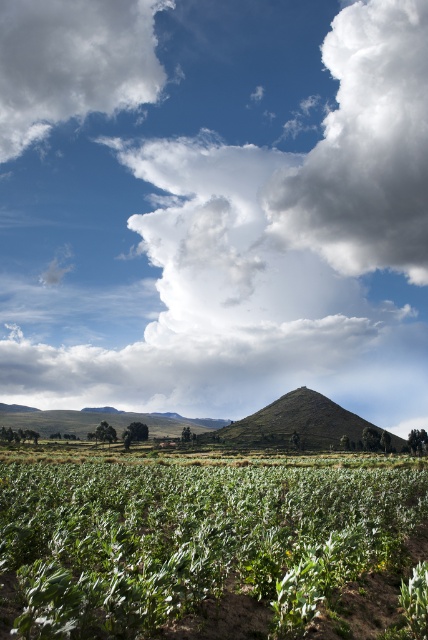
Looking at this image, which is above, white fluffy cloud at upper left or green grassy hill at center?

white fluffy cloud at upper left is higher up.

Consider the image. Who is more forward, (20, 81) or (299, 448)?

Point (299, 448)

Where is `white fluffy cloud at upper left`? This screenshot has width=428, height=640. white fluffy cloud at upper left is located at coordinates (74, 61).

Which is in front, point (92, 548) or point (403, 161)?

Point (92, 548) is in front.

Measure the distance between point (133,492) and camera.

Point (133,492) and camera are 20.13 meters apart.

Is point (235, 502) closer to camera compared to point (380, 193)?

Yes, it is.

Locate an element on the screen. green leafy plants at lower left is located at coordinates (193, 540).

Between green leafy plants at lower left and green grassy hill at center, which one has less height?

Standing shorter between the two is green leafy plants at lower left.

Does point (335, 490) come closer to viewer compared to point (249, 442)?

Yes, it is.

Where is `green leafy plants at lower left`? The height and width of the screenshot is (640, 428). green leafy plants at lower left is located at coordinates (193, 540).